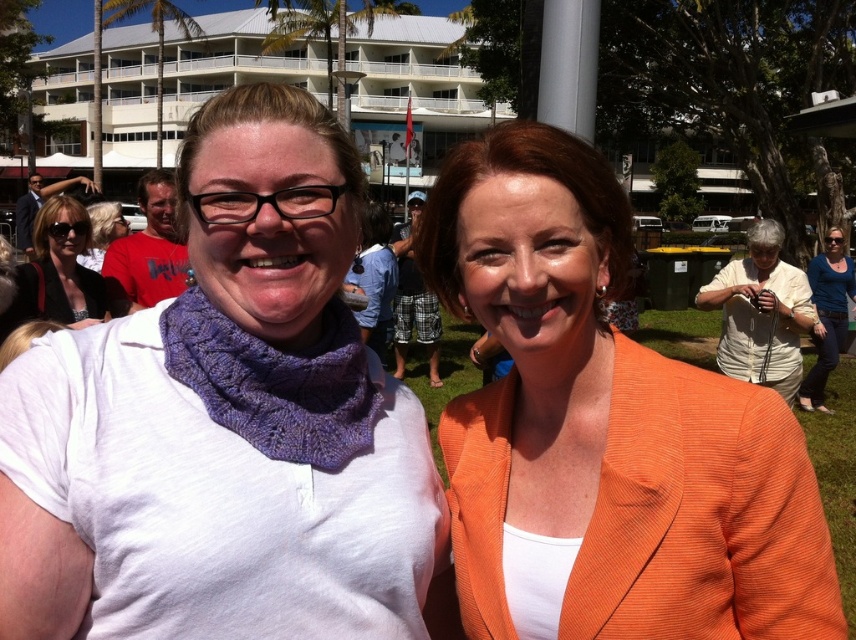
Question: Which point appears farthest from the camera in this image?

Choices:
 (A) (840, 268)
 (B) (57, 268)
 (C) (317, 419)
 (D) (759, 221)

Answer: (A)

Question: Among these points, which one is nearest to the camera?

Choices:
 (A) (813, 372)
 (B) (103, 218)
 (C) (331, 406)

Answer: (C)

Question: Does knitted purple scarf at left appear on the right side of blonde hair at center?

Choices:
 (A) no
 (B) yes

Answer: (B)

Question: Is orange textured blazer at center thinner than knitted purple scarf at left?

Choices:
 (A) no
 (B) yes

Answer: (A)

Question: From the image, what is the correct spatial relationship of purple knitted cowl at center in relation to white knitwear at right?

Choices:
 (A) right
 (B) left

Answer: (B)

Question: Which point is farther from the camera taking this photo?

Choices:
 (A) (379, 397)
 (B) (819, 348)

Answer: (B)